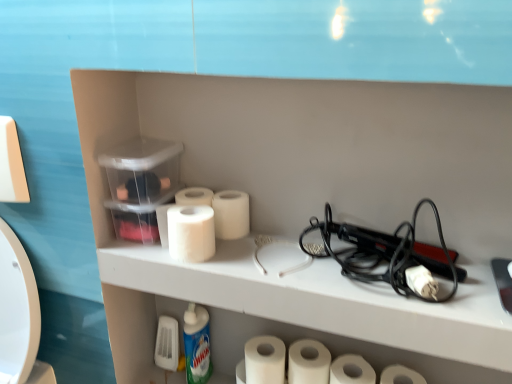
The height and width of the screenshot is (384, 512). Identify the location of free space between black plastic hair straightener at right and white matte toilet paper at center, which ranks as the 1th toilet paper in left-to-right order. (260, 255).